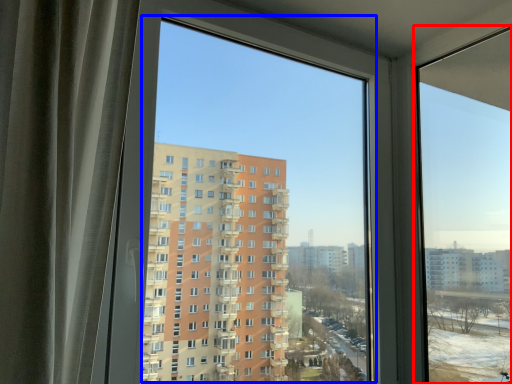
Question: Which object appears farthest to the camera in this image, window (highlighted by a red box) or window screen (highlighted by a blue box)?

Choices:
 (A) window
 (B) window screen

Answer: (A)